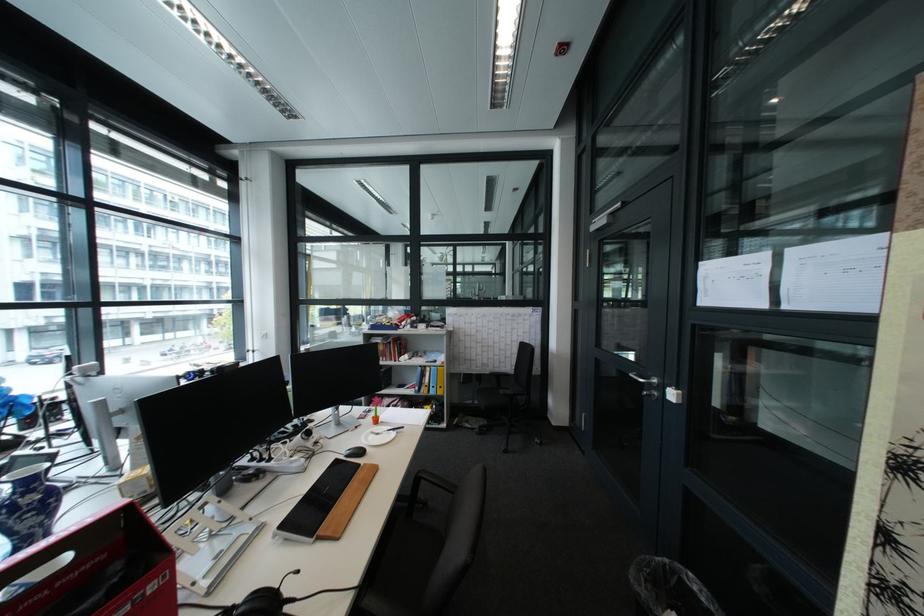
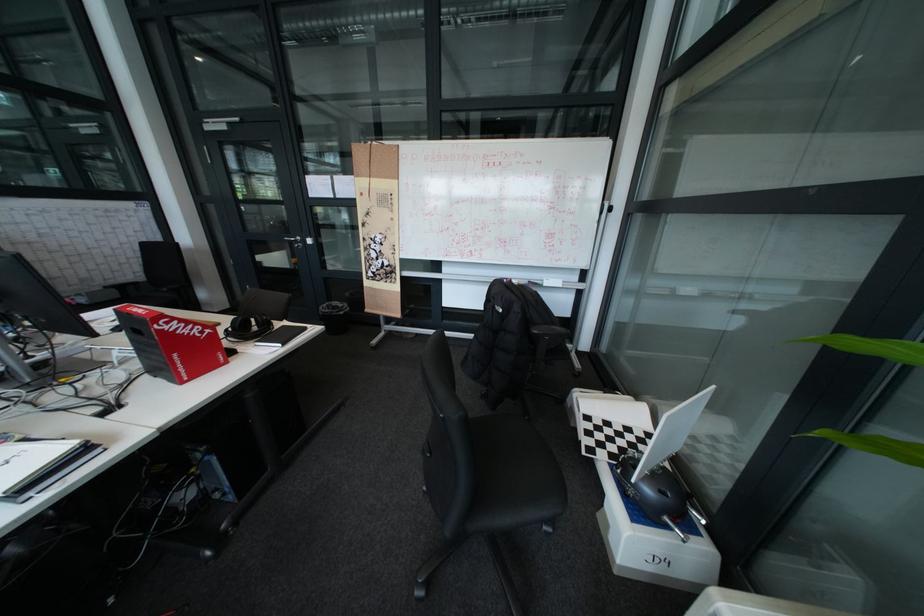
Where in the second image is the point corresponding to point (681, 561) from the first image?

(341, 304)